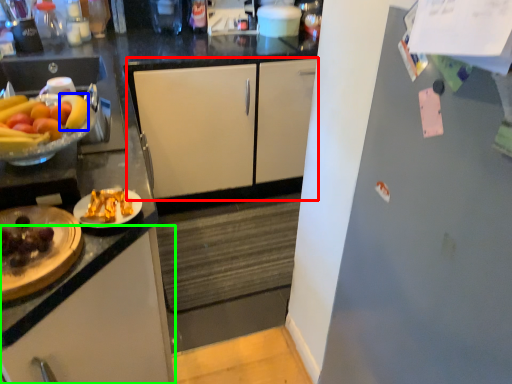
Question: Which object is positioned closest to cabinetry (highlighted by a red box)? Select from banana (highlighted by a blue box) and cabinetry (highlighted by a green box).

Choices:
 (A) banana
 (B) cabinetry

Answer: (A)